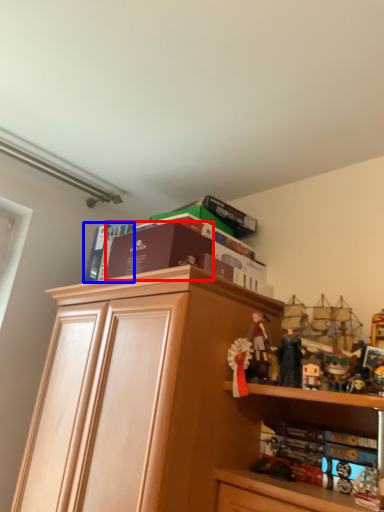
Question: Which object is further to the camera taking this photo, book (highlighted by a red box) or book (highlighted by a blue box)?

Choices:
 (A) book
 (B) book

Answer: (B)